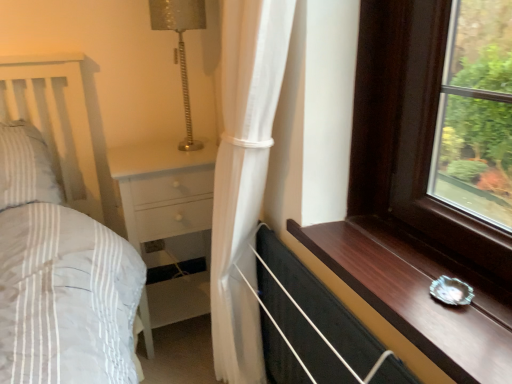
Question: From a real-world perspective, is white wood chest of drawers at center above or below metallic silver lamp at upper center?

Choices:
 (A) above
 (B) below

Answer: (B)

Question: Is white wood chest of drawers at center spatially inside metallic silver lamp at upper center, or outside of it?

Choices:
 (A) outside
 (B) inside

Answer: (A)

Question: Based on their relative distances, which object is nearer to the metallic silver lamp at upper center?

Choices:
 (A) dark wood window sill at lower right
 (B) white sheer curtain at center
 (C) white wood chest of drawers at center

Answer: (C)

Question: Based on their relative distances, which object is nearer to the metallic silver lamp at upper center?

Choices:
 (A) white sheer curtain at center
 (B) dark wood window sill at lower right
 (C) white wood chest of drawers at center

Answer: (C)